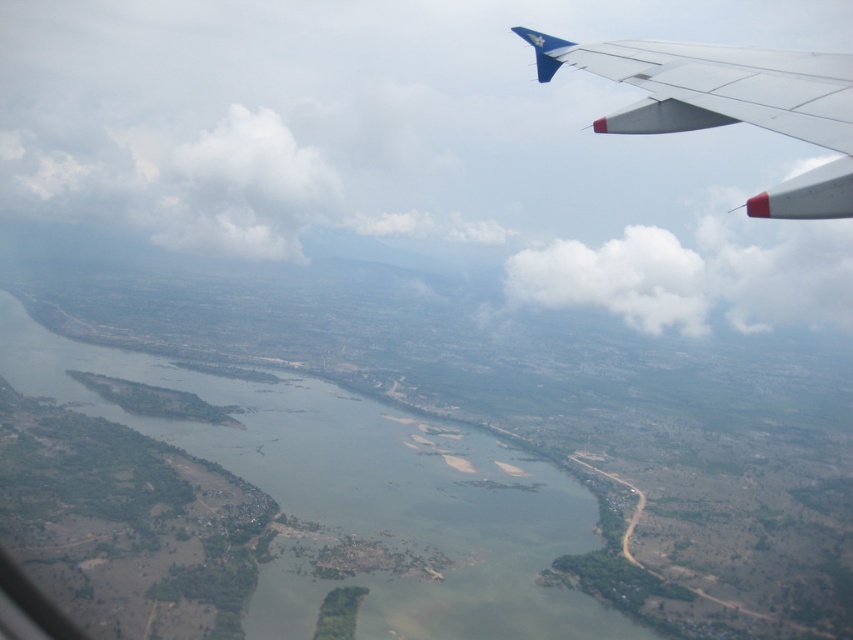
You are a passenger on the airplane and looking out the window. You see a point marked at coordinate (358,496). What does this point correspond to in the scene?

The point at coordinate (358,496) corresponds to the green sedimentary river at center.

You are a pilot looking at the view from the airplane window. You notice two points marked on the wing. The first point is at coordinates point (666, 100) and the second is at point (677, 253). From your perspective inside the plane, which point is closer to the front of the aircraft?

Point (666, 100) is in front of point (677, 253), so it is closer to the front of the aircraft.

You are a passenger on an airplane and looking out the window. You see the white matte wing at upper right and the white fluffy cloud at center. Which object appears smaller in the view?

The white matte wing at upper right appears smaller than the white fluffy cloud at center.